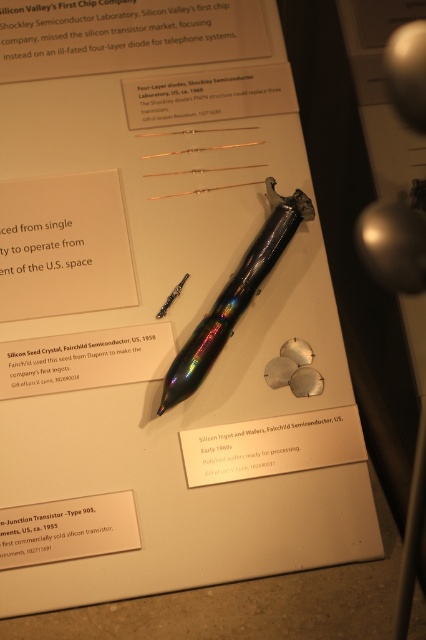
Question: Which object is farther from the camera taking this photo?

Choices:
 (A) white paper at upper left
 (B) black paper at upper center
 (C) silicon seed crystal at center

Answer: (B)

Question: Which of the following is the farthest from the observer?

Choices:
 (A) iridescent metallic pen at center
 (B) iridescent metallic fountain pen at center

Answer: (A)

Question: Does silicon seed crystal at center appear under rainbow iridescent pen at center?

Choices:
 (A) yes
 (B) no

Answer: (A)

Question: Does white paper at upper left have a lesser width compared to iridescent metallic fountain pen at center?

Choices:
 (A) no
 (B) yes

Answer: (A)

Question: Is white paper at upper left bigger than iridescent metallic fountain pen at center?

Choices:
 (A) yes
 (B) no

Answer: (A)

Question: Which object is the closest to the iridescent metallic pen at center?

Choices:
 (A) rainbow iridescent pen at center
 (B) matte black transistor at lower left

Answer: (A)